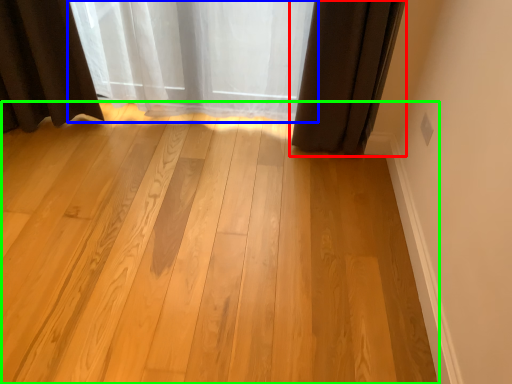
Question: Based on their relative distances, which object is nearer to curtain (highlighted by a red box)? Choose from curtain (highlighted by a blue box) and plank (highlighted by a green box).

Choices:
 (A) curtain
 (B) plank

Answer: (A)